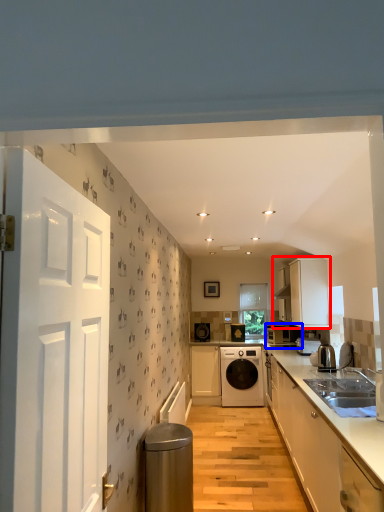
Question: Which point is further to the camera, cabinetry (highlighted by a red box) or kitchen appliance (highlighted by a blue box)?

Choices:
 (A) cabinetry
 (B) kitchen appliance

Answer: (B)